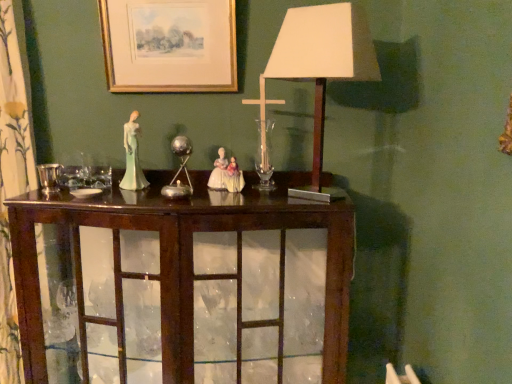
Question: Does metallic silver candle holder at center, positioned as the first candle holder in back-to-front order, have a greater width compared to mahogany cabinet at center?

Choices:
 (A) yes
 (B) no

Answer: (B)

Question: From a real-world perspective, is metallic silver candle holder at center, positioned as the first candle holder in back-to-front order, located beneath mahogany cabinet at center?

Choices:
 (A) yes
 (B) no

Answer: (B)

Question: Is metallic silver candle holder at center, arranged as the 2th candle holder when viewed from the left, surrounding mahogany cabinet at center?

Choices:
 (A) yes
 (B) no

Answer: (B)

Question: From the image's perspective, does metallic silver candle holder at center, marked as the 2th candle holder in a front-to-back arrangement, appear higher than mahogany cabinet at center?

Choices:
 (A) no
 (B) yes

Answer: (B)

Question: Is metallic silver candle holder at center, arranged as the 2th candle holder when viewed from the left, positioned behind mahogany cabinet at center?

Choices:
 (A) no
 (B) yes

Answer: (B)

Question: Considering the relative positions of metallic silver candle holder at center, marked as the 2th candle holder in a front-to-back arrangement, and mahogany cabinet at center in the image provided, is metallic silver candle holder at center, marked as the 2th candle holder in a front-to-back arrangement, in front of mahogany cabinet at center?

Choices:
 (A) no
 (B) yes

Answer: (A)

Question: Could you tell me if mahogany cabinet at center is facing gold-framed print at upper center?

Choices:
 (A) no
 (B) yes

Answer: (A)

Question: From the image's perspective, is mahogany cabinet at center over gold-framed print at upper center?

Choices:
 (A) no
 (B) yes

Answer: (A)

Question: Does mahogany cabinet at center touch gold-framed print at upper center?

Choices:
 (A) no
 (B) yes

Answer: (A)

Question: Are mahogany cabinet at center and gold-framed print at upper center located far from each other?

Choices:
 (A) no
 (B) yes

Answer: (A)

Question: From a real-world perspective, is mahogany cabinet at center under gold-framed print at upper center?

Choices:
 (A) no
 (B) yes

Answer: (B)

Question: Does mahogany cabinet at center appear on the right side of gold-framed print at upper center?

Choices:
 (A) yes
 (B) no

Answer: (A)

Question: Is porcelain figure at center aimed at white paper lampshade at center?

Choices:
 (A) yes
 (B) no

Answer: (B)